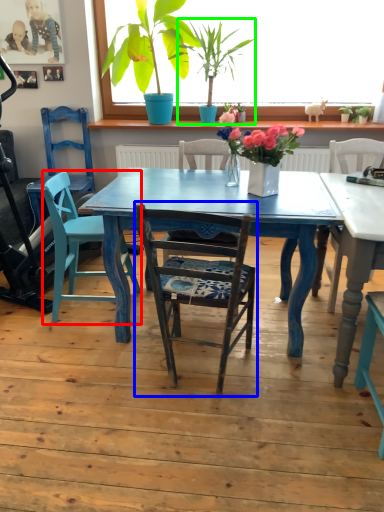
Question: Considering the real-world distances, which object is closest to swivel chair (highlighted by a red box)? chair (highlighted by a blue box) or houseplant (highlighted by a green box).

Choices:
 (A) chair
 (B) houseplant

Answer: (A)